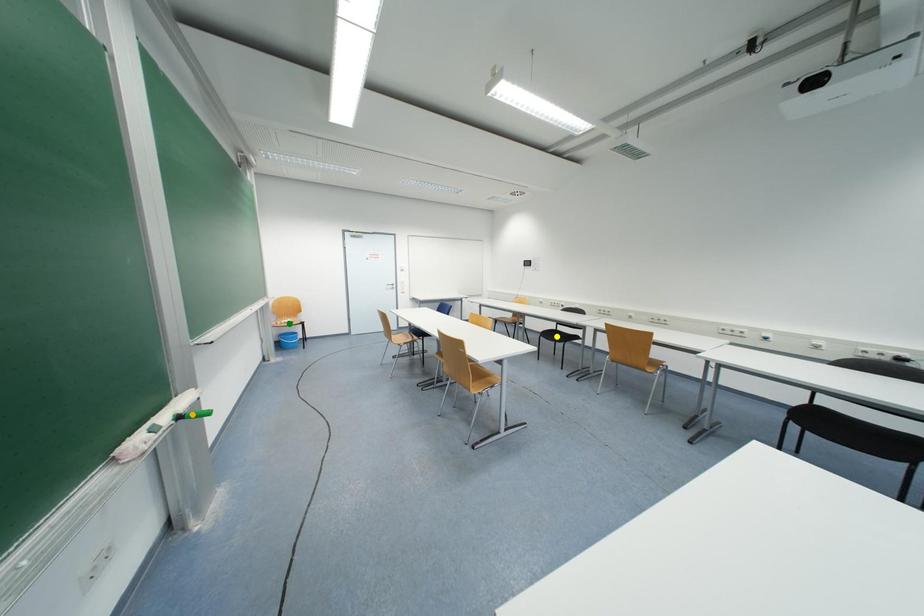
Order these from nearest to farthest:
orange point, yellow point, green point

green point
yellow point
orange point